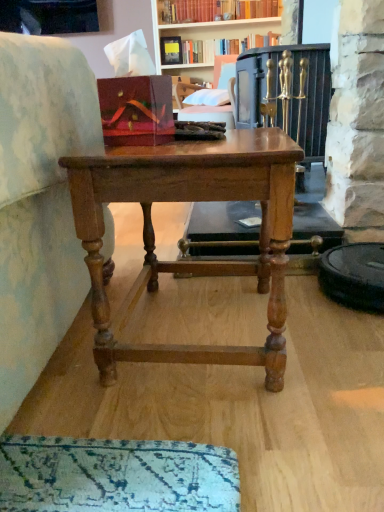
Question: Is wooden table at center completely or partially outside of velvet pink cushion at upper center?

Choices:
 (A) yes
 (B) no

Answer: (A)

Question: Can you confirm if wooden table at center is thinner than velvet pink cushion at upper center?

Choices:
 (A) no
 (B) yes

Answer: (B)

Question: Could you tell me if wooden table at center is turned towards velvet pink cushion at upper center?

Choices:
 (A) yes
 (B) no

Answer: (B)

Question: Can you confirm if wooden table at center is positioned to the right of velvet pink cushion at upper center?

Choices:
 (A) yes
 (B) no

Answer: (B)

Question: Is wooden table at center smaller than velvet pink cushion at upper center?

Choices:
 (A) no
 (B) yes

Answer: (A)

Question: Does point (228, 74) appear closer or farther from the camera than point (107, 342)?

Choices:
 (A) farther
 (B) closer

Answer: (A)

Question: Is velvet pink cushion at upper center spatially inside wooden table at center, or outside of it?

Choices:
 (A) inside
 (B) outside

Answer: (B)

Question: In terms of size, does velvet pink cushion at upper center appear bigger or smaller than wooden table at center?

Choices:
 (A) small
 (B) big

Answer: (A)

Question: Is velvet pink cushion at upper center wider or thinner than wooden table at center?

Choices:
 (A) thin
 (B) wide

Answer: (B)

Question: Would you say hardcover book at upper center is to the left or to the right of velvet pink cushion at upper center in the picture?

Choices:
 (A) left
 (B) right

Answer: (B)

Question: Is hardcover book at upper center situated inside velvet pink cushion at upper center or outside?

Choices:
 (A) inside
 (B) outside

Answer: (B)

Question: Is point (228, 42) closer or farther from the camera than point (218, 70)?

Choices:
 (A) farther
 (B) closer

Answer: (A)

Question: From a real-world perspective, is hardcover book at upper center above or below velvet pink cushion at upper center?

Choices:
 (A) above
 (B) below

Answer: (A)

Question: Is point (218, 66) closer or farther from the camera than point (165, 53)?

Choices:
 (A) closer
 (B) farther

Answer: (A)

Question: From a real-world perspective, relative to hardcover book at upper center, is velvet pink cushion at upper center vertically above or below?

Choices:
 (A) above
 (B) below

Answer: (B)